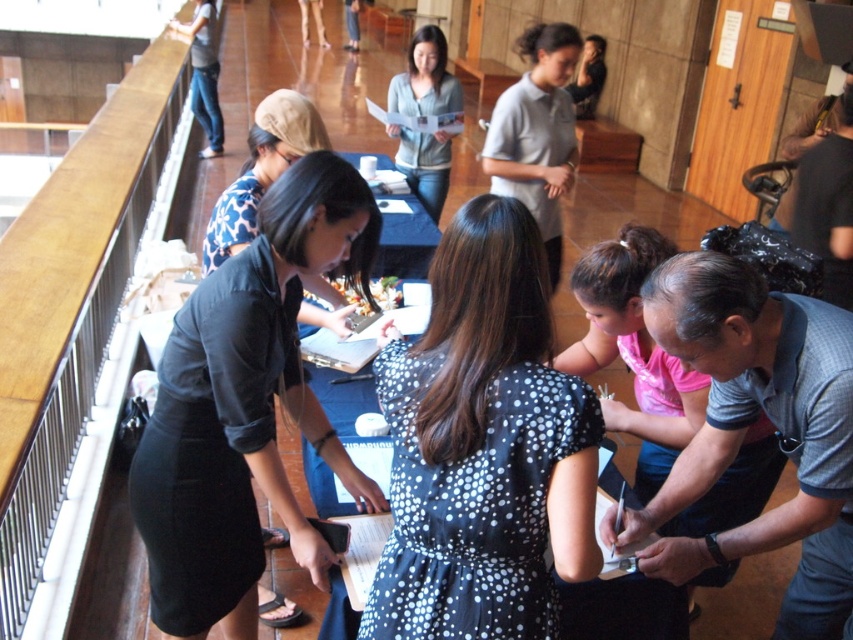
Question: Which point is farther to the camera?

Choices:
 (A) black dotted dress at center
 (B) matte black dress at center
 (C) light blue knit sweater at center

Answer: (C)

Question: Is matte black dress at center bigger than white uniform shirt at center?

Choices:
 (A) no
 (B) yes

Answer: (A)

Question: Which of these objects is positioned farthest from the matte black dress at center?

Choices:
 (A) white uniform shirt at center
 (B) light blue knit sweater at center

Answer: (B)

Question: Does black dotted dress at center have a larger size compared to white uniform shirt at center?

Choices:
 (A) no
 (B) yes

Answer: (A)

Question: Is the position of black dotted dress at center more distant than that of light blue knit sweater at center?

Choices:
 (A) yes
 (B) no

Answer: (B)

Question: Which point is farther to the camera?

Choices:
 (A) light blue knit sweater at center
 (B) matte black dress at center
 (C) black dotted dress at center
 (D) white uniform shirt at center

Answer: (A)